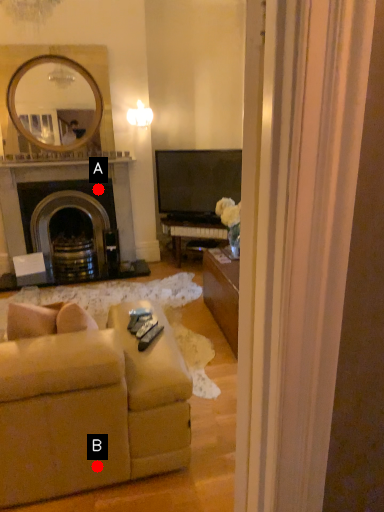
Question: Two points are circled on the image, labeled by A and B beside each circle. Which of the following is the farthest from the observer?

Choices:
 (A) A is further
 (B) B is further

Answer: (A)